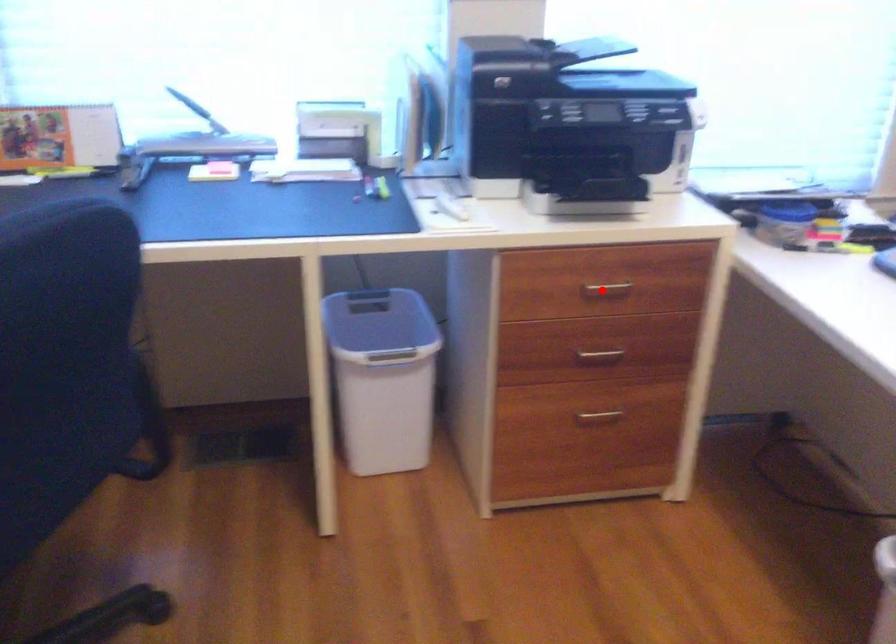
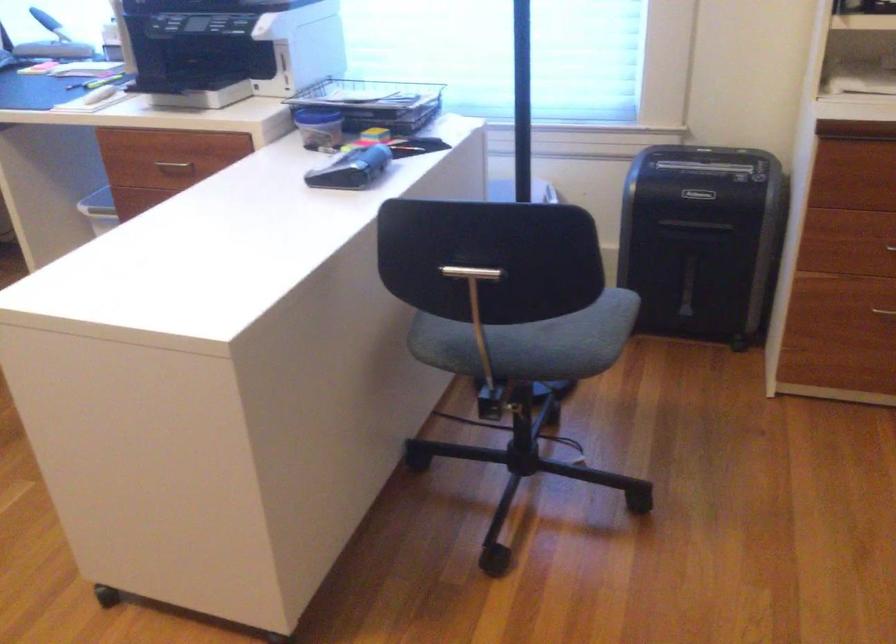
In the second image, find the point that corresponds to the highlighted location in the first image.

(174, 165)